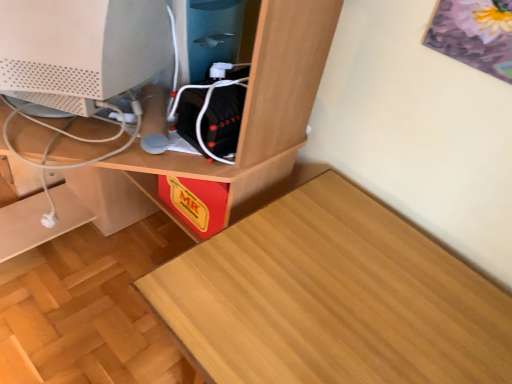
Question: Can you confirm if wooden desk at center is shorter than white matte computer monitor at center?

Choices:
 (A) yes
 (B) no

Answer: (B)

Question: Does wooden desk at center turn towards white matte computer monitor at center?

Choices:
 (A) yes
 (B) no

Answer: (A)

Question: Is wooden desk at center in front of white matte computer monitor at center?

Choices:
 (A) yes
 (B) no

Answer: (A)

Question: Is wooden desk at center beside white matte computer monitor at center?

Choices:
 (A) yes
 (B) no

Answer: (A)

Question: From the image's perspective, would you say wooden desk at center is shown under white matte computer monitor at center?

Choices:
 (A) no
 (B) yes

Answer: (B)

Question: From the image's perspective, is wooden desk at center on white matte computer monitor at center?

Choices:
 (A) no
 (B) yes

Answer: (A)

Question: Is wooden table at lower left oriented towards white matte computer monitor at center?

Choices:
 (A) no
 (B) yes

Answer: (A)

Question: Is wooden table at lower left closer to camera compared to white matte computer monitor at center?

Choices:
 (A) yes
 (B) no

Answer: (A)

Question: Does wooden table at lower left touch white matte computer monitor at center?

Choices:
 (A) no
 (B) yes

Answer: (A)

Question: Can you confirm if wooden table at lower left is shorter than white matte computer monitor at center?

Choices:
 (A) no
 (B) yes

Answer: (A)

Question: Is the depth of wooden table at lower left greater than that of white matte computer monitor at center?

Choices:
 (A) no
 (B) yes

Answer: (A)

Question: Is wooden table at lower left at the left side of white matte computer monitor at center?

Choices:
 (A) yes
 (B) no

Answer: (B)

Question: From a real-world perspective, is wooden desk at center positioned under wooden table at lower left based on gravity?

Choices:
 (A) no
 (B) yes

Answer: (A)